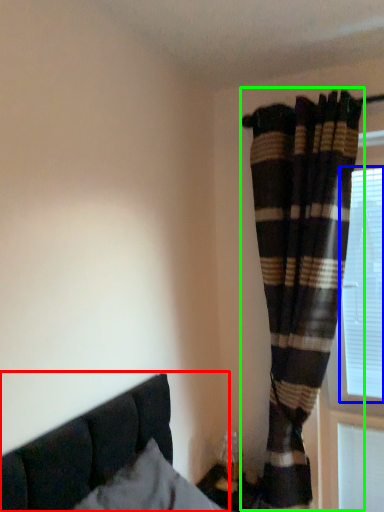
Question: Which object is positioned farthest from bed (highlighted by a red box)? Select from bay window (highlighted by a blue box) and curtain (highlighted by a green box).

Choices:
 (A) bay window
 (B) curtain

Answer: (A)